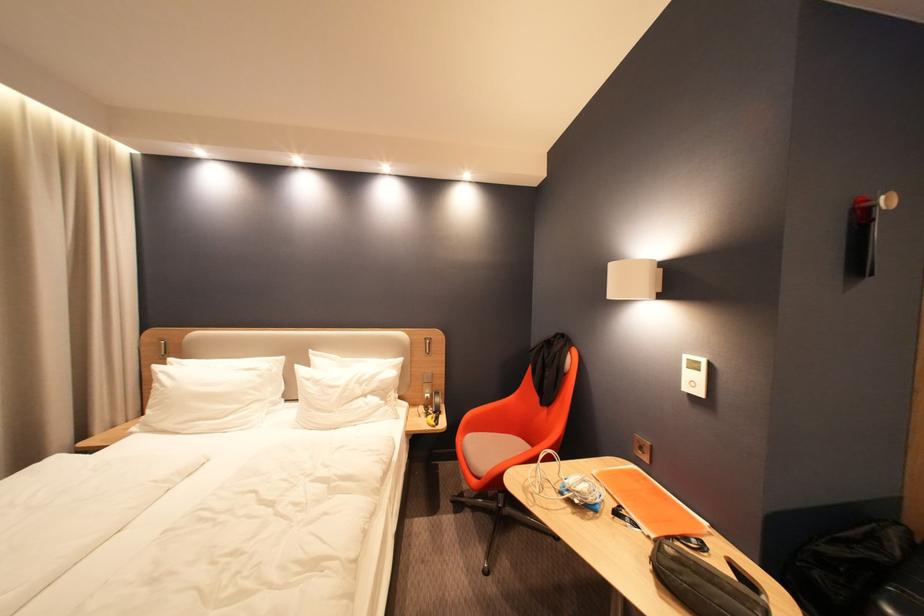
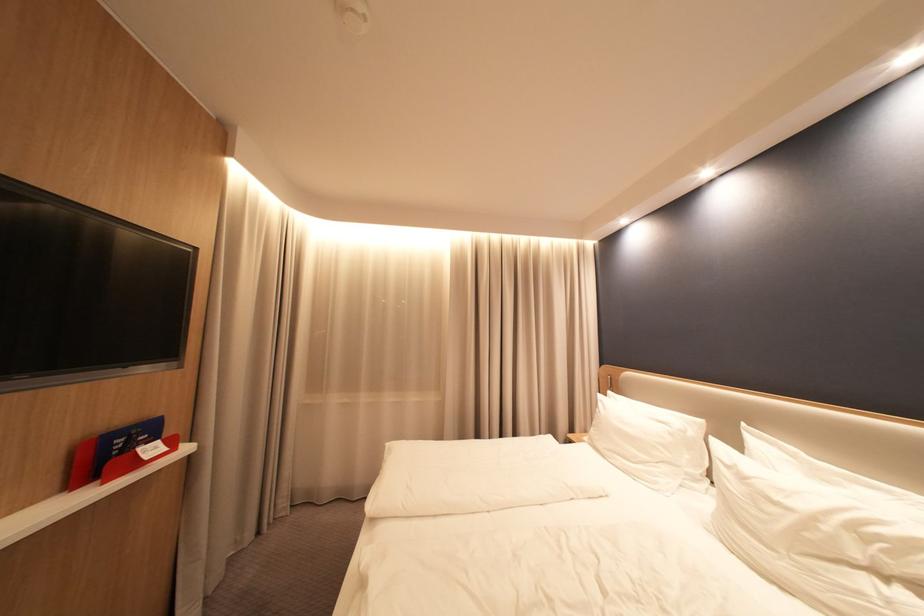
Question: The camera is either moving clockwise (left) or counter-clockwise (right) around the object. The first image is from the beginning of the video and the second image is from the end. Is the camera moving left or right when shooting the video?

Choices:
 (A) Left
 (B) Right

Answer: (B)